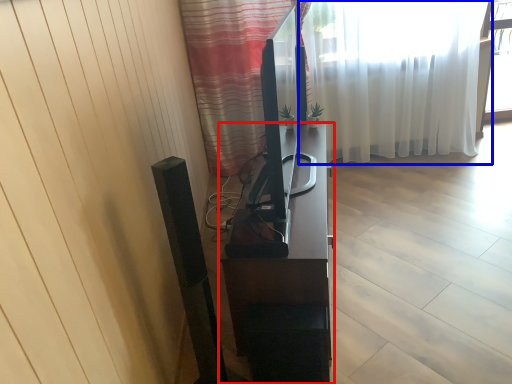
Question: Which object appears closest to the camera in this image, furniture (highlighted by a red box) or curtain (highlighted by a blue box)?

Choices:
 (A) furniture
 (B) curtain

Answer: (A)